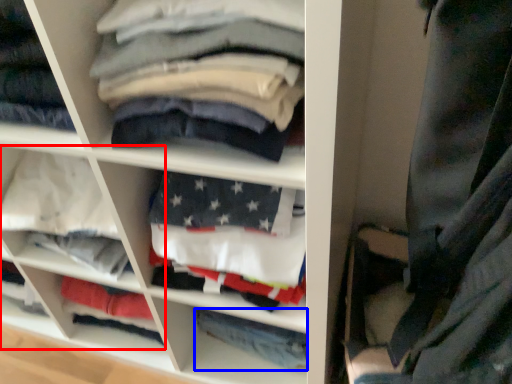
Question: Which of the following is the farthest to the observer, cabinet (highlighted by a red box) or trousers (highlighted by a blue box)?

Choices:
 (A) cabinet
 (B) trousers

Answer: (B)